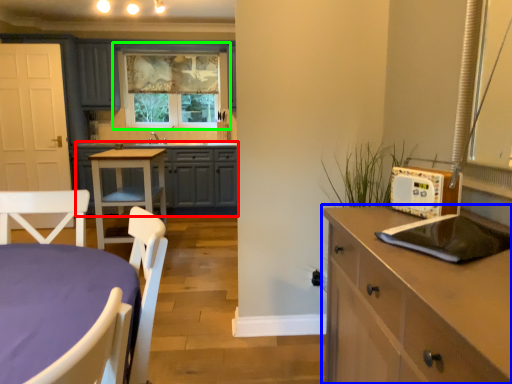
Question: Estimate the real-world distances between objects in this image. Which object is closer to cabinetry (highlighted by a red box), cabinetry (highlighted by a blue box) or window (highlighted by a green box)?

Choices:
 (A) cabinetry
 (B) window

Answer: (B)